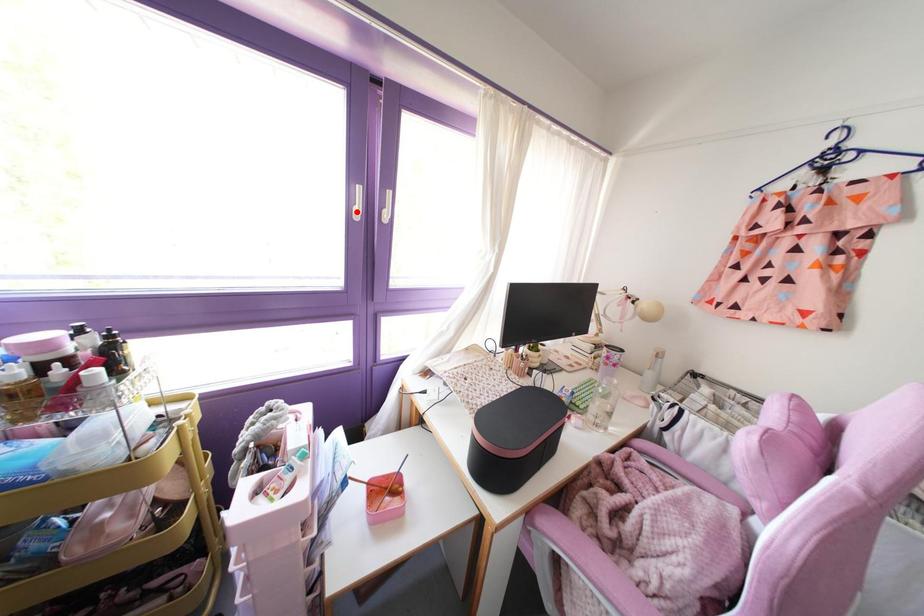
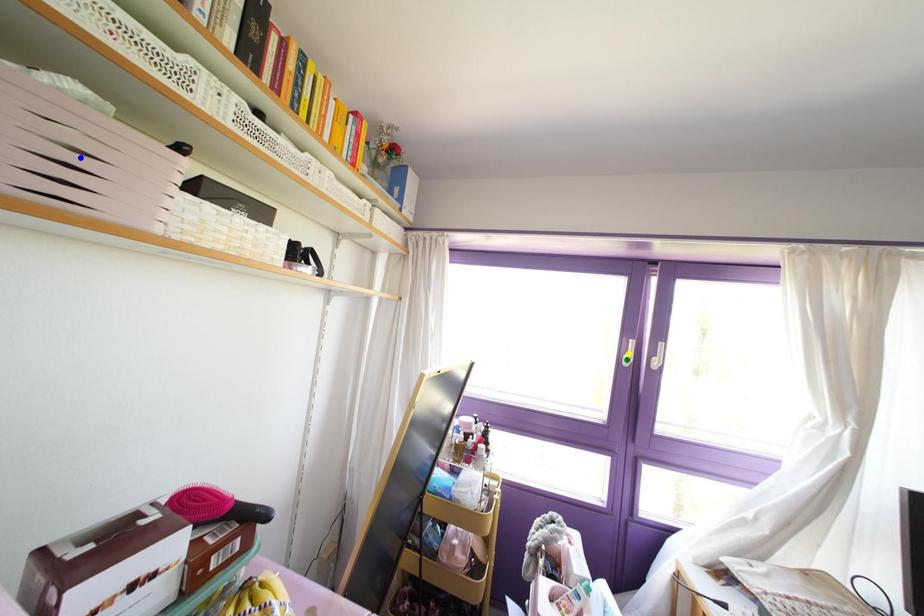
Question: I am providing you with two images of the same scene from different viewpoints. A red point is marked on the first image. You are given multiple points on the second image. Can you choose the point in image 2 that corresponds to the point in image 1?

Choices:
 (A) yellow point
 (B) green point
 (C) blue point

Answer: (B)